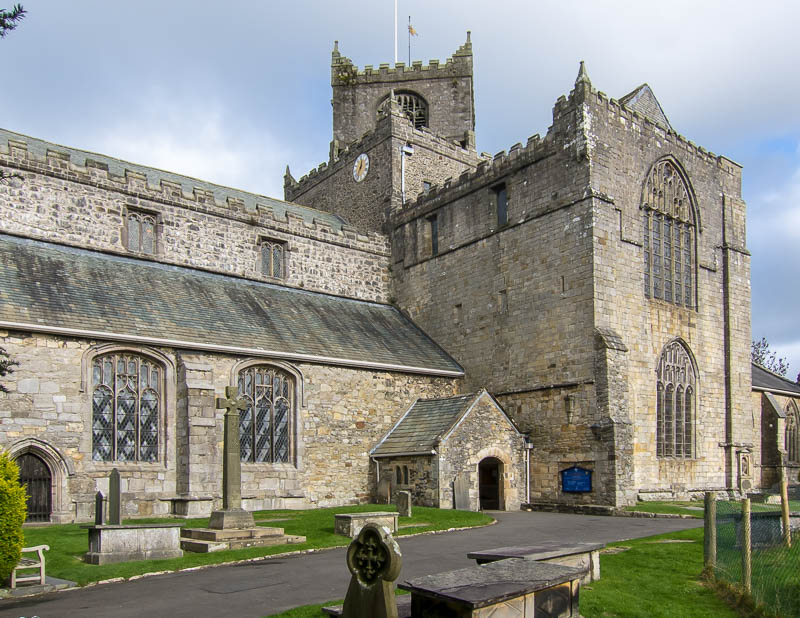
Find the location of a particular element. Image resolution: width=800 pixels, height=618 pixels. clock is located at coordinates (364, 164).